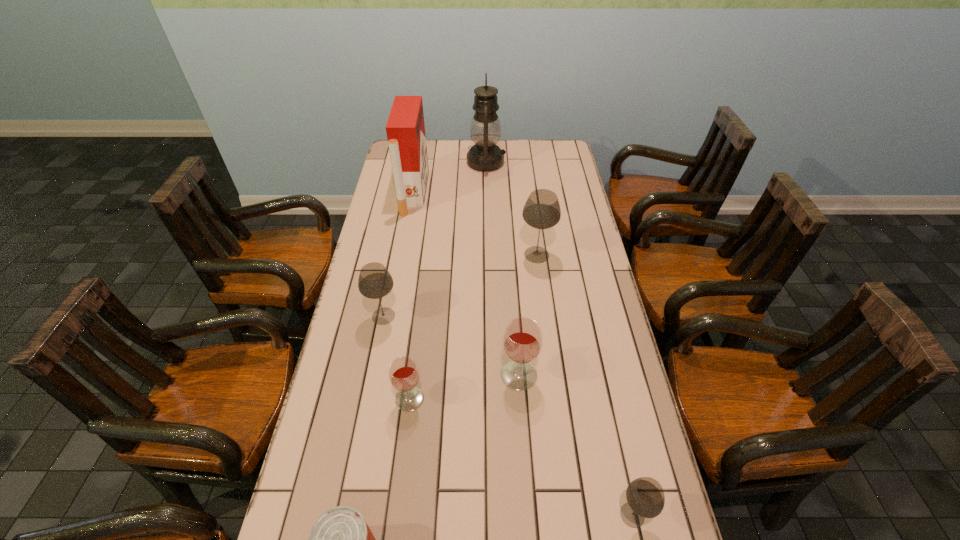
Identify the location of vacant space that satisfies the following two spatial constraints: 1. on the back side of the rightmost gray wineglass; 2. on the front-facing side of the red cigarette case. (562, 193).

Where is `free space that satisfies the following two spatial constraints: 1. on the front-facing side of the rightmost object; 2. on the left side of the red cigarette case`? free space that satisfies the following two spatial constraints: 1. on the front-facing side of the rightmost object; 2. on the left side of the red cigarette case is located at coordinates (356, 515).